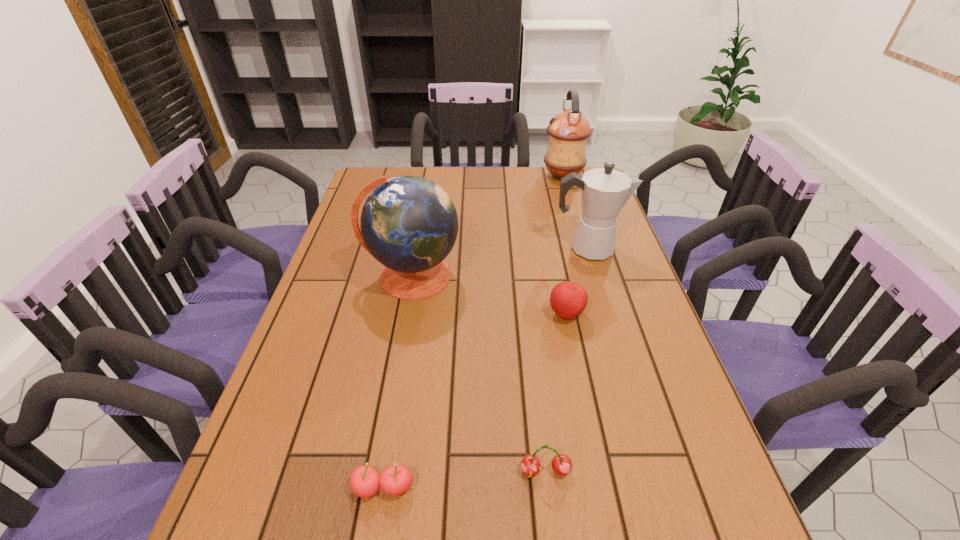
This screenshot has width=960, height=540. I want to click on vacant space located with stems pointing upwards on the fourth object from right to left, so [552, 533].

Where is `free space located 0.350m on the right of the left cherry`? free space located 0.350m on the right of the left cherry is located at coordinates (599, 488).

Where is `object that is at the far edge`? object that is at the far edge is located at coordinates (568, 131).

Where is `object present at the left edge`? object present at the left edge is located at coordinates (409, 224).

Locate an element on the screen. oil lamp situated at the right edge is located at coordinates click(568, 131).

You are a GUI agent. You are given a task and a screenshot of the screen. Output one action in this format:
    pyautogui.click(x=<x>, y=<y>)
    Task: Click on the coffeepot at the right edge
    This screenshot has width=960, height=540.
    Given the screenshot: What is the action you would take?
    pyautogui.click(x=605, y=191)

I want to click on object that is positioned at the far right corner, so click(568, 131).

Find the location of a particular element. vacant space at the far edge of the desktop is located at coordinates click(490, 186).

Find the location of a particular element. free space at the left edge of the desktop is located at coordinates (340, 290).

In order to click on free space at the right edge of the desktop in this screenshot , I will do `click(617, 262)`.